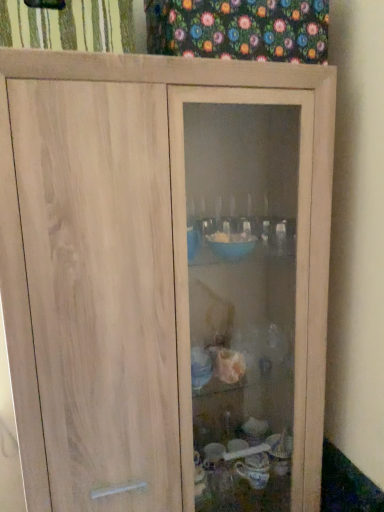
Find the location of `green striped fabric at upper left, arranged as the 1th curtain when viewed from the left`. green striped fabric at upper left, arranged as the 1th curtain when viewed from the left is located at coordinates (70, 26).

Image resolution: width=384 pixels, height=512 pixels. What do you see at coordinates (70, 26) in the screenshot?
I see `green striped fabric at upper left, the 2th curtain in the right-to-left sequence` at bounding box center [70, 26].

How much space does green striped fabric at upper left, arranged as the 1th curtain when viewed from the left, occupy vertically?

7.27 inches.

I want to click on floral fabric at upper center, which is counted as the second curtain, starting from the left, so click(239, 29).

What do you see at coordinates (239, 29) in the screenshot?
I see `floral fabric at upper center, which is counted as the second curtain, starting from the left` at bounding box center [239, 29].

In order to click on green striped fabric at upper left, arranged as the 1th curtain when viewed from the left in this screenshot , I will do `click(70, 26)`.

Does floral fabric at upper center, which is counted as the 1th curtain, starting from the right, appear on the right side of green striped fabric at upper left, the 2th curtain in the right-to-left sequence?

Indeed, floral fabric at upper center, which is counted as the 1th curtain, starting from the right, is positioned on the right side of green striped fabric at upper left, the 2th curtain in the right-to-left sequence.

Is floral fabric at upper center, which is counted as the 1th curtain, starting from the right, positioned in front of green striped fabric at upper left, arranged as the 1th curtain when viewed from the left?

No, it is behind green striped fabric at upper left, arranged as the 1th curtain when viewed from the left.

Which is less distant, (325,50) or (49,32)?

Point (325,50) is positioned farther from the camera compared to point (49,32).

From the image's perspective, would you say floral fabric at upper center, which is counted as the 1th curtain, starting from the right, is positioned over green striped fabric at upper left, arranged as the 1th curtain when viewed from the left?

Correct, floral fabric at upper center, which is counted as the 1th curtain, starting from the right, appears higher than green striped fabric at upper left, arranged as the 1th curtain when viewed from the left, in the image.

From a real-world perspective, between floral fabric at upper center, which is counted as the 1th curtain, starting from the right, and green striped fabric at upper left, arranged as the 1th curtain when viewed from the left, who is vertically lower?

green striped fabric at upper left, arranged as the 1th curtain when viewed from the left, from a real-world perspective.

Which of these two, floral fabric at upper center, which is counted as the 1th curtain, starting from the right, or green striped fabric at upper left, arranged as the 1th curtain when viewed from the left, is thinner?

floral fabric at upper center, which is counted as the 1th curtain, starting from the right, is thinner.

Who is taller, floral fabric at upper center, which is counted as the 1th curtain, starting from the right, or green striped fabric at upper left, the 2th curtain in the right-to-left sequence?

floral fabric at upper center, which is counted as the 1th curtain, starting from the right, is taller.

Does floral fabric at upper center, which is counted as the second curtain, starting from the left, have a smaller size compared to green striped fabric at upper left, the 2th curtain in the right-to-left sequence?

Actually, floral fabric at upper center, which is counted as the second curtain, starting from the left, might be larger than green striped fabric at upper left, the 2th curtain in the right-to-left sequence.

Is floral fabric at upper center, which is counted as the 1th curtain, starting from the right, surrounding green striped fabric at upper left, the 2th curtain in the right-to-left sequence?

No, green striped fabric at upper left, the 2th curtain in the right-to-left sequence, is not surrounded by floral fabric at upper center, which is counted as the 1th curtain, starting from the right.

Would you consider floral fabric at upper center, which is counted as the second curtain, starting from the left, to be distant from green striped fabric at upper left, arranged as the 1th curtain when viewed from the left?

Actually, floral fabric at upper center, which is counted as the second curtain, starting from the left, and green striped fabric at upper left, arranged as the 1th curtain when viewed from the left, are a little close together.

Could you tell me if floral fabric at upper center, which is counted as the second curtain, starting from the left, is facing green striped fabric at upper left, the 2th curtain in the right-to-left sequence?

No, floral fabric at upper center, which is counted as the second curtain, starting from the left, is not facing towards green striped fabric at upper left, the 2th curtain in the right-to-left sequence.

How different are the orientations of floral fabric at upper center, which is counted as the 1th curtain, starting from the right, and green striped fabric at upper left, the 2th curtain in the right-to-left sequence, in degrees?

0.379 degrees.

How distant is floral fabric at upper center, which is counted as the 1th curtain, starting from the right, from green striped fabric at upper left, the 2th curtain in the right-to-left sequence?

floral fabric at upper center, which is counted as the 1th curtain, starting from the right, is 10.48 inches from green striped fabric at upper left, the 2th curtain in the right-to-left sequence.

Find the location of a particular element. This screenshot has width=384, height=512. curtain below the floral fabric at upper center, which is counted as the second curtain, starting from the left (from a real-world perspective) is located at coordinates (70, 26).

Between green striped fabric at upper left, the 2th curtain in the right-to-left sequence, and floral fabric at upper center, which is counted as the 1th curtain, starting from the right, which one appears on the left side from the viewer's perspective?

green striped fabric at upper left, the 2th curtain in the right-to-left sequence.

Based on the photo, in the image, is green striped fabric at upper left, arranged as the 1th curtain when viewed from the left, positioned in front of or behind floral fabric at upper center, which is counted as the 1th curtain, starting from the right?

green striped fabric at upper left, arranged as the 1th curtain when viewed from the left, is positioned closer to the viewer than floral fabric at upper center, which is counted as the 1th curtain, starting from the right.

Is point (123, 45) more distant than point (174, 4)?

No, (123, 45) is in front of (174, 4).

From the image's perspective, which one is positioned higher, green striped fabric at upper left, arranged as the 1th curtain when viewed from the left, or floral fabric at upper center, which is counted as the 1th curtain, starting from the right?

floral fabric at upper center, which is counted as the 1th curtain, starting from the right, is shown above in the image.

From a real-world perspective, does green striped fabric at upper left, the 2th curtain in the right-to-left sequence, sit lower than floral fabric at upper center, which is counted as the 1th curtain, starting from the right?

Yes, from a real-world perspective, green striped fabric at upper left, the 2th curtain in the right-to-left sequence, is beneath floral fabric at upper center, which is counted as the 1th curtain, starting from the right.

Is green striped fabric at upper left, arranged as the 1th curtain when viewed from the left, wider than floral fabric at upper center, which is counted as the second curtain, starting from the left?

Yes.

Is green striped fabric at upper left, the 2th curtain in the right-to-left sequence, taller or shorter than floral fabric at upper center, which is counted as the 1th curtain, starting from the right?

green striped fabric at upper left, the 2th curtain in the right-to-left sequence, is shorter than floral fabric at upper center, which is counted as the 1th curtain, starting from the right.

Does green striped fabric at upper left, arranged as the 1th curtain when viewed from the left, have a smaller size compared to floral fabric at upper center, which is counted as the 1th curtain, starting from the right?

Yes.

Is floral fabric at upper center, which is counted as the 1th curtain, starting from the right, a part of green striped fabric at upper left, the 2th curtain in the right-to-left sequence?

No, floral fabric at upper center, which is counted as the 1th curtain, starting from the right, is not inside green striped fabric at upper left, the 2th curtain in the right-to-left sequence.

Is green striped fabric at upper left, the 2th curtain in the right-to-left sequence, beside floral fabric at upper center, which is counted as the 1th curtain, starting from the right?

green striped fabric at upper left, the 2th curtain in the right-to-left sequence, is not next to floral fabric at upper center, which is counted as the 1th curtain, starting from the right, and they're not touching.

Is green striped fabric at upper left, arranged as the 1th curtain when viewed from the left, aimed at floral fabric at upper center, which is counted as the second curtain, starting from the left?

No, green striped fabric at upper left, arranged as the 1th curtain when viewed from the left, is not facing towards floral fabric at upper center, which is counted as the second curtain, starting from the left.

From the picture: Measure the distance from green striped fabric at upper left, the 2th curtain in the right-to-left sequence, to floral fabric at upper center, which is counted as the second curtain, starting from the left.

green striped fabric at upper left, the 2th curtain in the right-to-left sequence, is 26.62 centimeters from floral fabric at upper center, which is counted as the second curtain, starting from the left.

At what (x,y) coordinates should I click in order to perform the action: click on curtain on the left of floral fabric at upper center, which is counted as the 1th curtain, starting from the right. Please return your answer as a coordinate pair (x, y). This screenshot has width=384, height=512. Looking at the image, I should click on (70, 26).

Identify the location of curtain located underneath the floral fabric at upper center, which is counted as the 1th curtain, starting from the right (from a real-world perspective). (70, 26).

Where is `curtain above the green striped fabric at upper left, arranged as the 1th curtain when viewed from the left (from the image's perspective)`? The image size is (384, 512). curtain above the green striped fabric at upper left, arranged as the 1th curtain when viewed from the left (from the image's perspective) is located at coordinates 239,29.